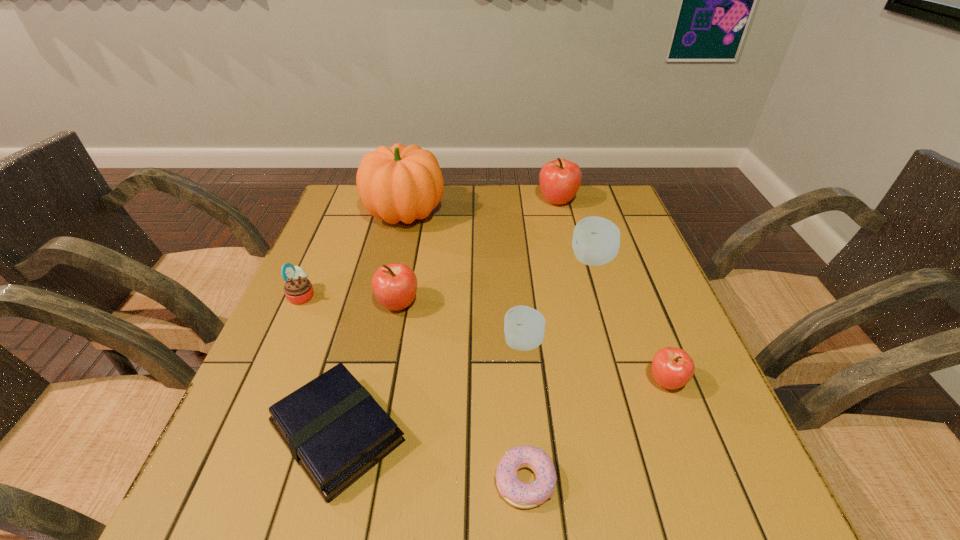
You are a GUI agent. You are given a task and a screenshot of the screen. Output one action in this format:
    pyautogui.click(x=<x>, y=<y>)
    Task: Click on the smaller white apple
    The height and width of the screenshot is (540, 960).
    Given the screenshot: What is the action you would take?
    pyautogui.click(x=524, y=327)

I want to click on the sixth farthest object, so click(524, 327).

Locate an element on the screen. This screenshot has height=540, width=960. the nearest pink apple is located at coordinates (672, 368).

This screenshot has width=960, height=540. Identify the location of the rightmost pink apple. (672, 368).

I want to click on book, so click(335, 430).

I want to click on blue book, so click(x=335, y=430).

Locate an element on the screen. This screenshot has width=960, height=540. doughnut is located at coordinates (523, 495).

Identify the location of the shortest object. (523, 495).

The image size is (960, 540). What are the coordinates of `vacant space located 0.160m on the right of the orange pumpkin` in the screenshot? It's located at (499, 213).

I want to click on vacant space located 0.290m on the front of the biggest pink apple, so click(576, 275).